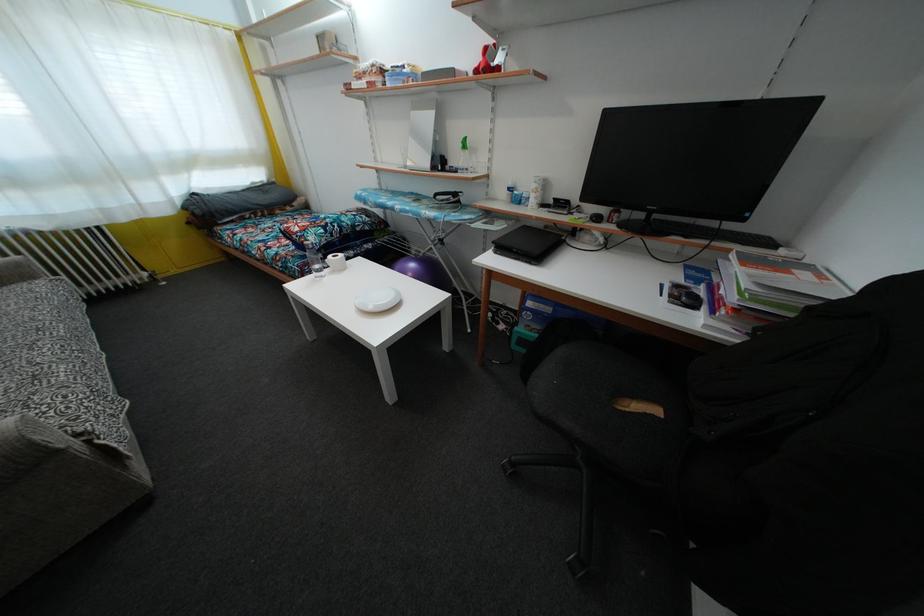
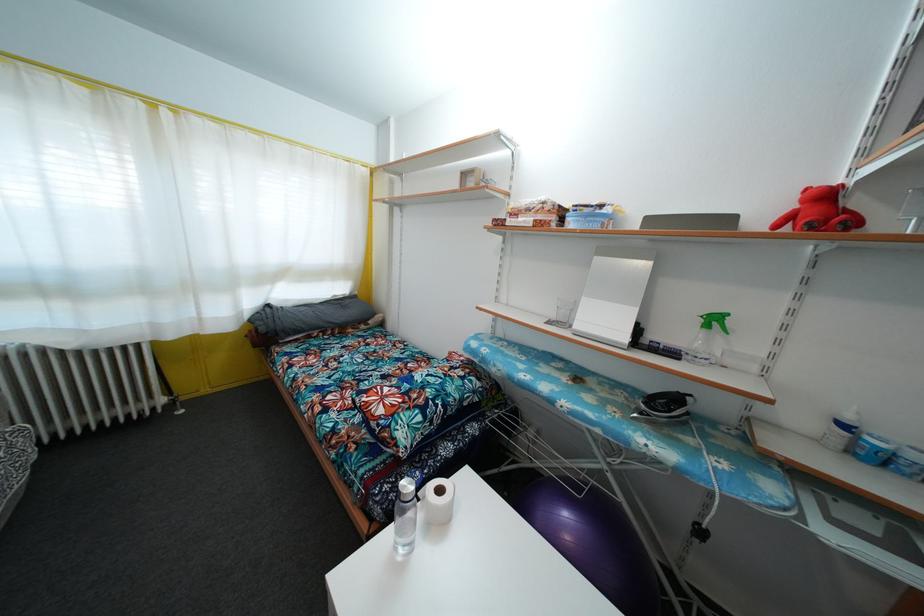
The point at (276, 187) is marked in the first image. Where is the corresponding point in the second image?

(359, 300)